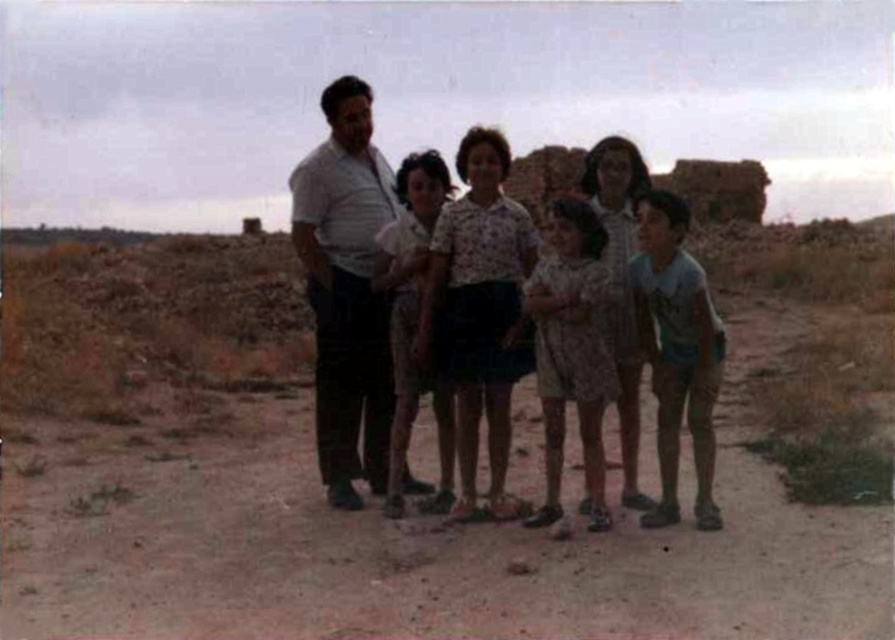
You are a photographer trying to capture a group photo of the two adults and four children in the desert landscape. You notice the white cotton shirt at center and the blue cotton shirt at right. Which adult should you ask to stand closer to the camera to ensure both shirts are visible in the photo?

The white cotton shirt at center has a greater height compared to blue cotton shirt at right, so the adult wearing the blue cotton shirt at right should be asked to stand closer to the camera to ensure both shirts are visible.

You are a photographer trying to capture a photo of the group. You notice the white cotton shirt at center and the blue cotton shirt at right. Which shirt should you focus on first to ensure both are in sharp focus?

The white cotton shirt at center is closer to you than the blue cotton shirt at right. To ensure both are in sharp focus, you should focus on the white cotton shirt at center first as it is closer, and the blue cotton shirt at right will fall within the depth of field if properly adjusted.

You are standing at the point marked as point (320,157) in the desert scene. If you want to walk back to the starting point which is 100 feet behind you, how many more feet do you need to walk?

The distance of point (320,157) from viewer is 74.60 feet. Therefore, you need to walk an additional 25.4 feet to reach the starting point 100 feet behind you.